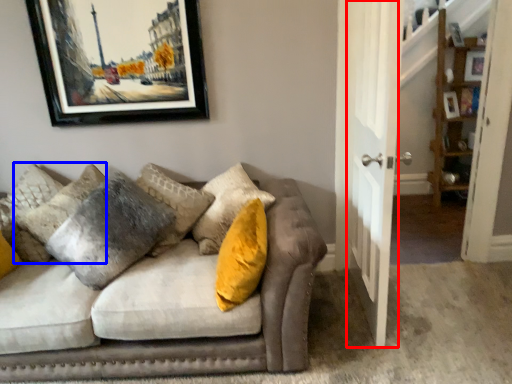
Question: Which of the following is the farthest to the observer, door (highlighted by a red box) or pillow (highlighted by a blue box)?

Choices:
 (A) door
 (B) pillow

Answer: (B)